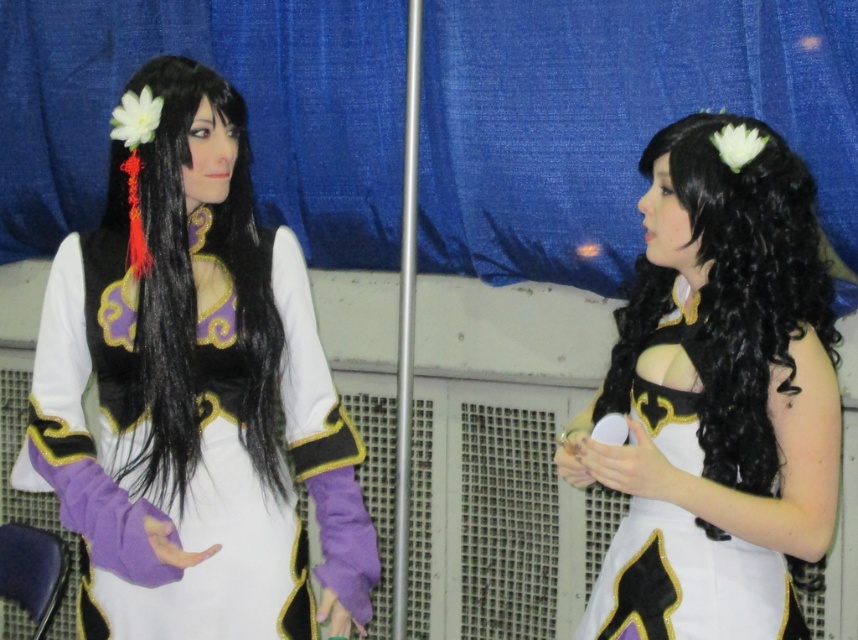
Which is more to the left, white matte dress at center or black silky hair at left?

black silky hair at left is more to the left.

Consider the image. Is white matte dress at center taller than black silky hair at left?

Yes.

Does point (659, 202) come farther from viewer compared to point (275, 460)?

No, it is in front of (275, 460).

The image size is (858, 640). I want to click on white matte dress at center, so click(x=726, y=356).

Between matte black dress at center and white matte dress at center, which one has more height?

matte black dress at center

Does matte black dress at center appear over white matte dress at center?

Correct, matte black dress at center is located above white matte dress at center.

Is point (293, 520) less distant than point (692, 474)?

That is False.

Locate an element on the screen. This screenshot has height=640, width=858. matte black dress at center is located at coordinates (192, 392).

Does matte black dress at center appear over black silky hair at left?

No, matte black dress at center is not above black silky hair at left.

Does matte black dress at center come in front of black silky hair at left?

That is True.

Who is more forward, (97, 625) or (162, 64)?

Point (162, 64)

The width and height of the screenshot is (858, 640). What are the coordinates of `matte black dress at center` in the screenshot? It's located at (192, 392).